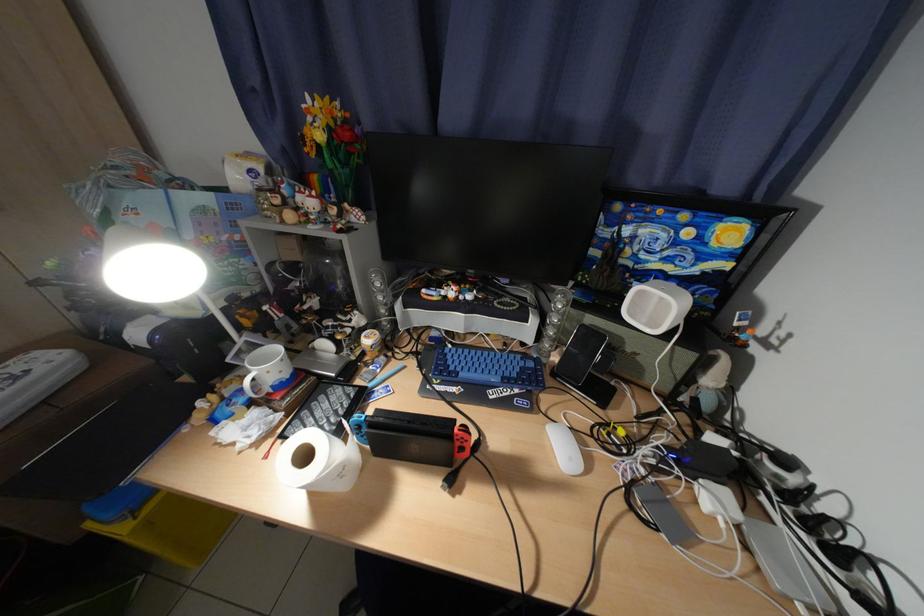
Where is `blue keyboard keys`? blue keyboard keys is located at coordinates (478, 363).